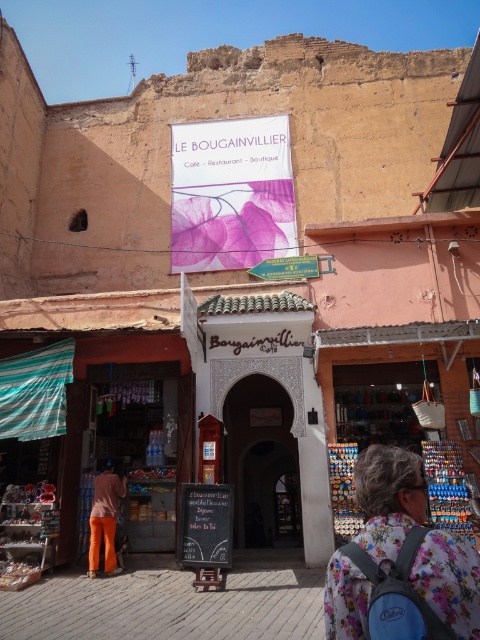
Between black chalkboard sign at center and orange fabric pants at lower left, which one appears on the left side from the viewer's perspective?

Positioned to the left is orange fabric pants at lower left.

Who is more distant from viewer, (189, 561) or (88, 554)?

The point (88, 554) is more distant.

Which is behind, point (189, 518) or point (117, 509)?

The point (117, 509) is behind.

Where is `black chalkboard sign at center`? The image size is (480, 640). black chalkboard sign at center is located at coordinates (205, 524).

Based on the photo, which is more to the right, pink paper sign at upper center or orange fabric pants at lower left?

From the viewer's perspective, pink paper sign at upper center appears more on the right side.

Identify the location of pink paper sign at upper center. (230, 193).

The image size is (480, 640). I want to click on pink paper sign at upper center, so click(x=230, y=193).

Who is positioned more to the right, floral fabric backpack at lower right or orange fabric pants at lower left?

From the viewer's perspective, floral fabric backpack at lower right appears more on the right side.

Which is in front, point (331, 602) or point (108, 467)?

Point (331, 602) is more forward.

The width and height of the screenshot is (480, 640). Find the location of `floral fabric backpack at lower right`. floral fabric backpack at lower right is located at coordinates pos(388,499).